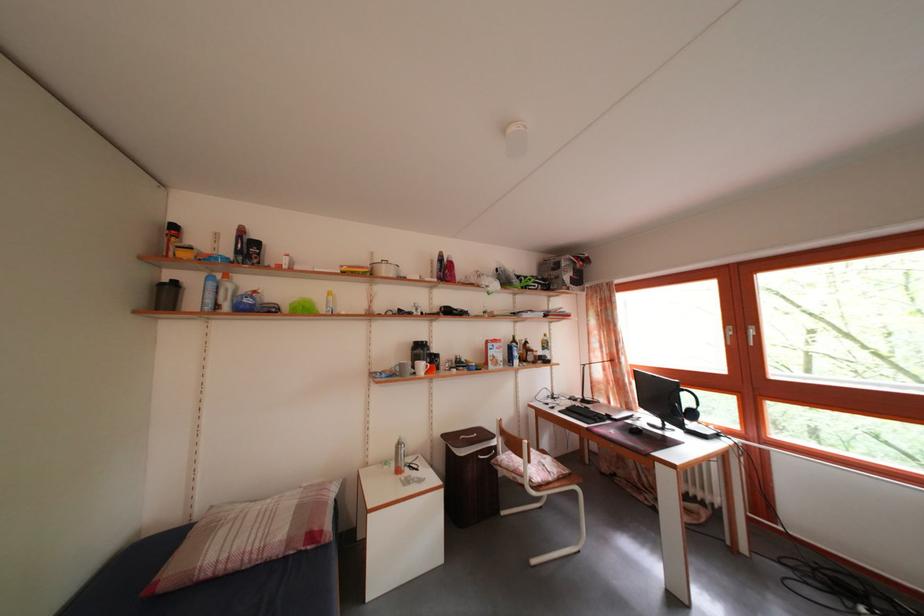
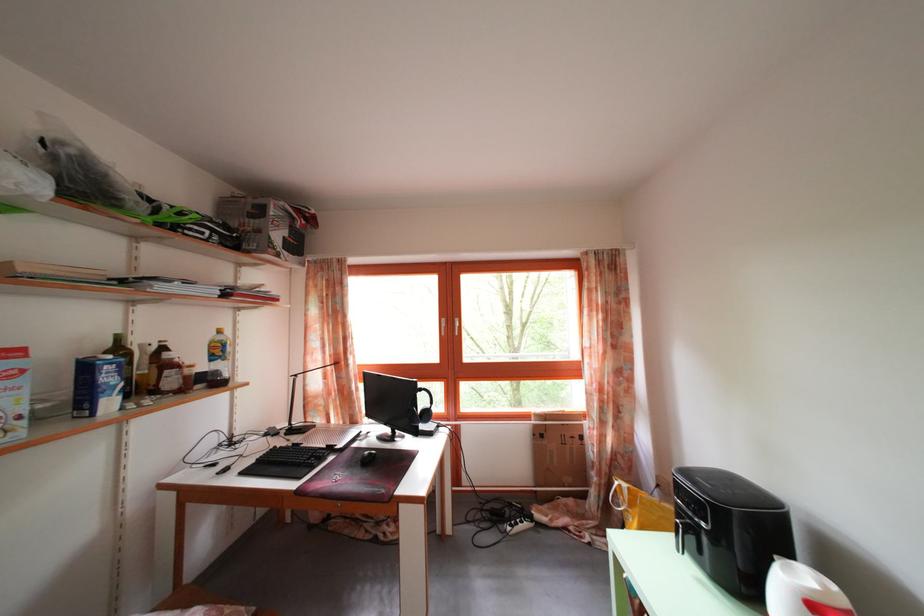
The point at (596, 424) is marked in the first image. Where is the corresponding point in the second image?

(307, 472)